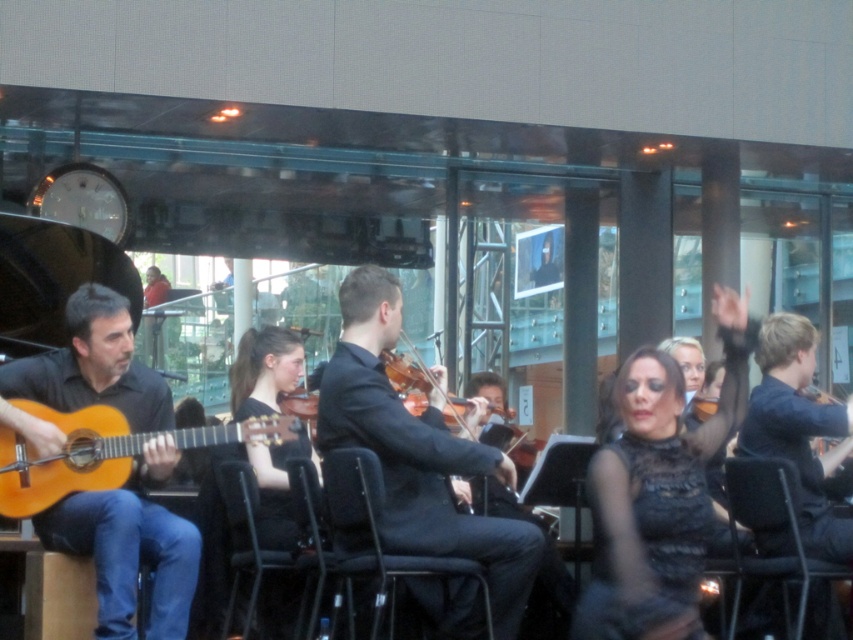
Is light brown wood guitar at left to the right of black plastic chair at lower right from the viewer's perspective?

No, light brown wood guitar at left is not to the right of black plastic chair at lower right.

Based on the photo, which of these two, light brown wood guitar at left or black plastic chair at lower right, stands taller?

Standing taller between the two is black plastic chair at lower right.

Is point (19, 460) in front of point (744, 522)?

Yes, it is.

This screenshot has height=640, width=853. I want to click on light brown wood guitar at left, so (x=102, y=452).

Is black smooth suit at center closer to camera compared to black fabric chair at center?

That is False.

Can you confirm if black smooth suit at center is positioned below black fabric chair at center?

Actually, black smooth suit at center is above black fabric chair at center.

Identify the location of black smooth suit at center. (419, 452).

Can you confirm if matte black guitar at left is positioned below black fabric chair at center?

No.

At what (x,y) coordinates should I click in order to perform the action: click on matte black guitar at left. Please return your answer as a coordinate pair (x, y). Looking at the image, I should click on (128, 557).

The width and height of the screenshot is (853, 640). I want to click on matte black guitar at left, so click(128, 557).